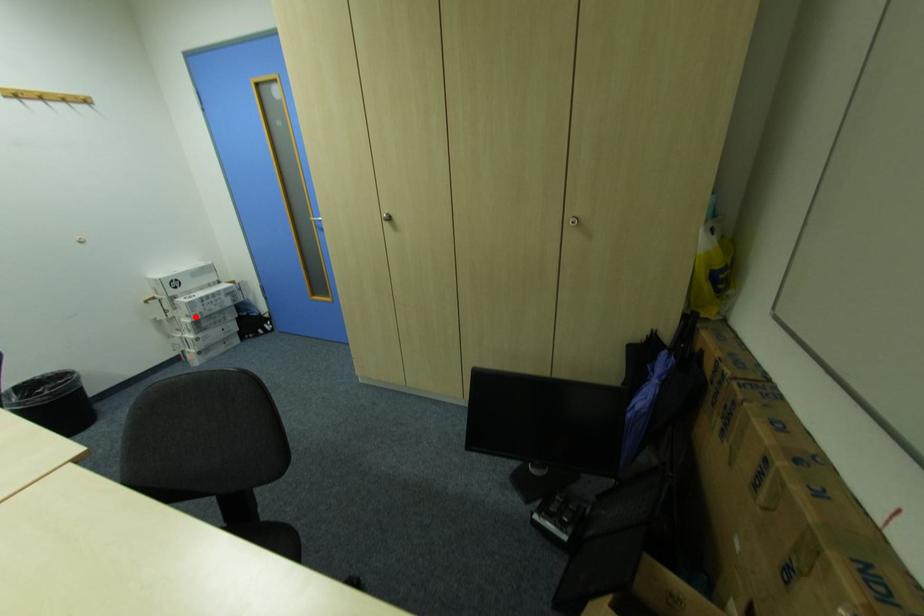
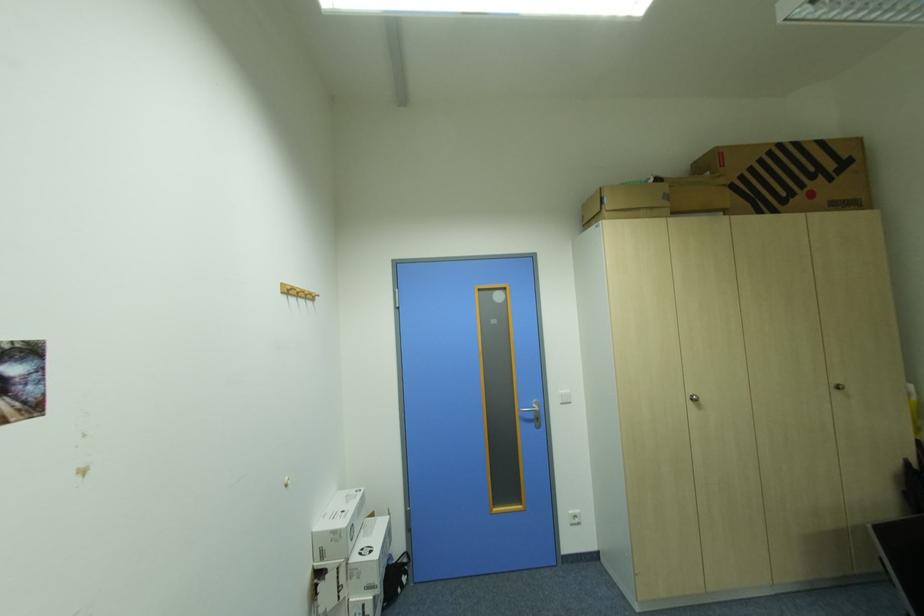
Question: I am providing you with two images of the same scene from different viewpoints. In image1, a red point is highlighted. Considering the same 3D point in image2, which of the following is correct?

Choices:
 (A) It is closer
 (B) It is farther

Answer: (B)